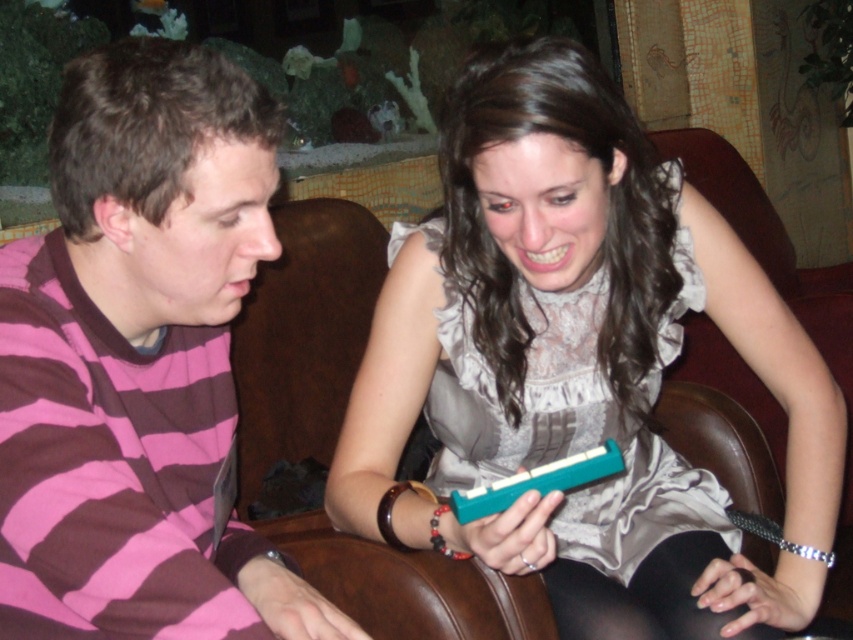
You are a photographer taking a portrait of two people sitting on a couch. You need to ensure that the teal plastic harmonica at center and the pink striped shirt at left are both visible in the frame. Based on their positions, which object is closer to the right edge of the photo?

The teal plastic harmonica at center is closer to the right edge of the photo because it is positioned to the right of the pink striped shirt at left.

You are a photographer taking a portrait of the two people on the couch. You want to ensure the teal plastic harmonica at center is visible in the shot. Should you adjust your camera angle to look upward or downward to include it without blocking the pink striped shirt at left?

The teal plastic harmonica at center is positioned under the pink striped shirt at left, so adjusting the camera angle to look downward will help include the harmonica while avoiding blocking the shirt.